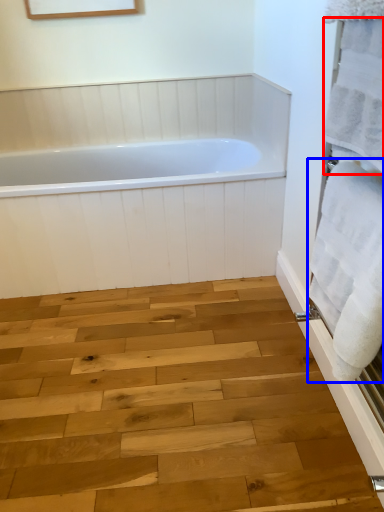
Question: Which object appears closest to the camera in this image, bath towel (highlighted by a red box) or bath towel (highlighted by a blue box)?

Choices:
 (A) bath towel
 (B) bath towel

Answer: (A)